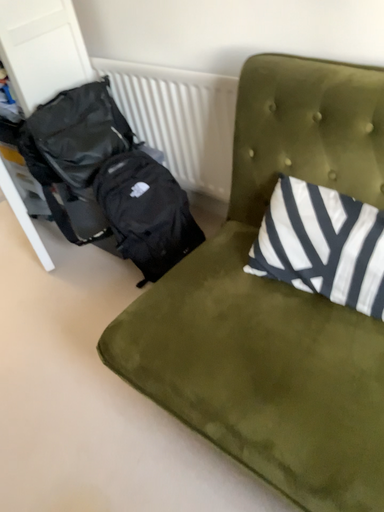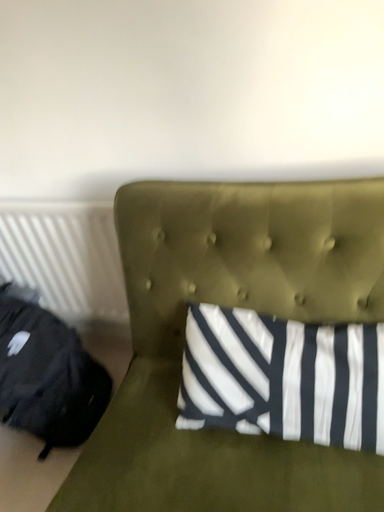
Question: Which way did the camera rotate in the video?

Choices:
 (A) rotated downward
 (B) rotated upward

Answer: (B)